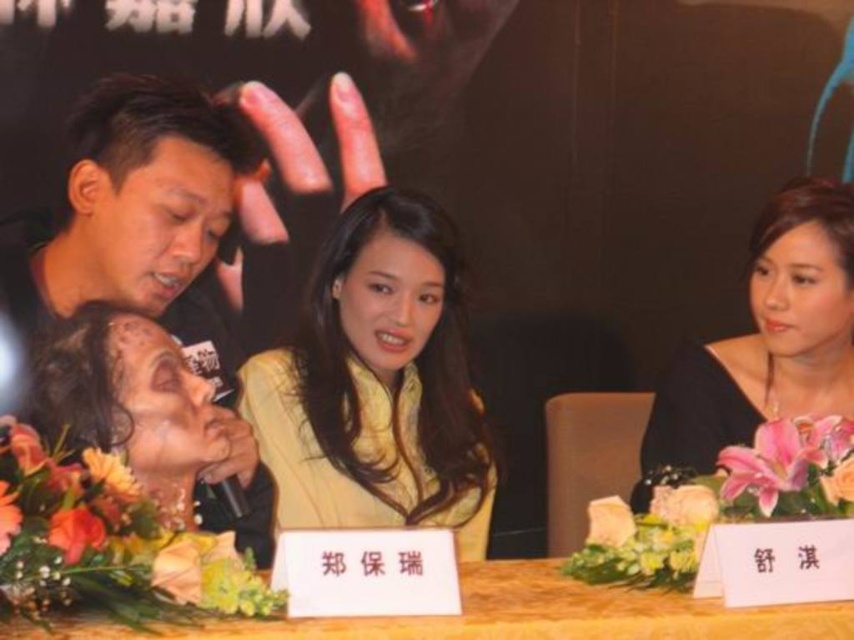
Does yellow matte jacket at center have a larger size compared to black silk dress at right?

Correct, yellow matte jacket at center is larger in size than black silk dress at right.

Is yellow matte jacket at center positioned behind black silk dress at right?

That is False.

Who is more distant from viewer, (x=414, y=218) or (x=676, y=449)?

Point (x=676, y=449)

Identify the location of yellow matte jacket at center. The height and width of the screenshot is (640, 854). (376, 385).

Which is in front, point (822, 371) or point (746, 627)?

Point (746, 627) is in front.

Is point (753, 308) farther from viewer compared to point (360, 620)?

Yes, it is.

At what (x,y) coordinates should I click in order to perform the action: click on black silk dress at right. Please return your answer as a coordinate pair (x, y). Looking at the image, I should click on (765, 339).

Can you confirm if yellow matte jacket at center is positioned to the left of wooden table at center?

Correct, you'll find yellow matte jacket at center to the left of wooden table at center.

Is point (264, 461) closer to viewer compared to point (534, 611)?

No, (264, 461) is further to viewer.

Identify the location of yellow matte jacket at center. The height and width of the screenshot is (640, 854). (376, 385).